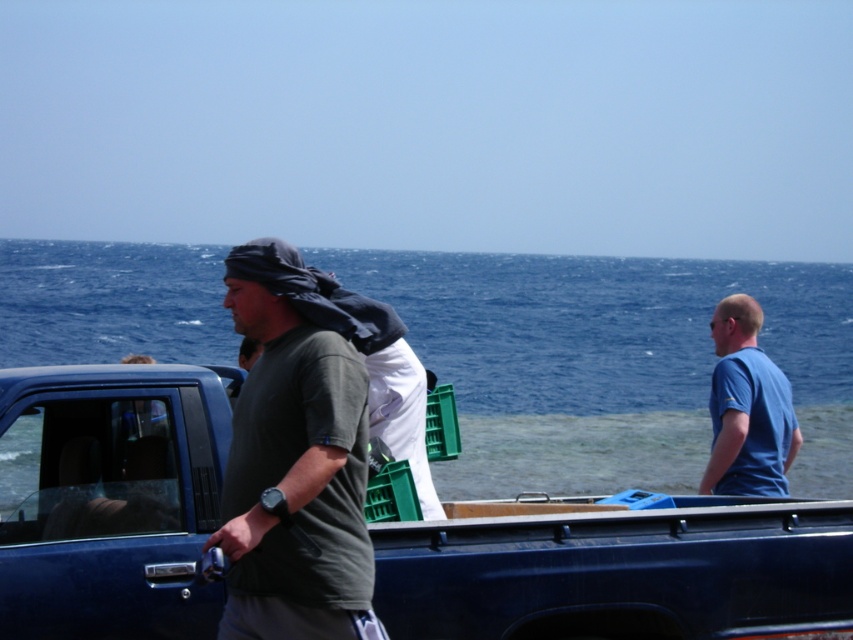
You are a delivery driver who needs to unload the dark green fabric truck at center. You notice the blue water at center nearby. Is the truck currently on stable ground or at risk of floating away?

The blue water at center is positioned over dark green fabric truck at center, which means the truck is in the water. Since water can cause instability, the truck is at risk of floating away and not on stable ground.

You are standing at the location of the blue matte shirt at right and want to throw a ball to someone standing at the blue water at center. If the ball can travel 60 meters, will it reach the person?

The blue water at center and blue matte shirt at right are 61.15 meters apart. Since the ball can only travel 60 meters, it will not reach the person at the blue water at center.

Consider the image. You are a delivery person who needs to load a package onto the dark green fabric truck at center and the blue matte shirt at right. Which one is closer to the loading zone located on the left side of the scene?

The dark green fabric truck at center is positioned on the left side of blue matte shirt at right, so it is closer to the loading zone on the left side of the scene.